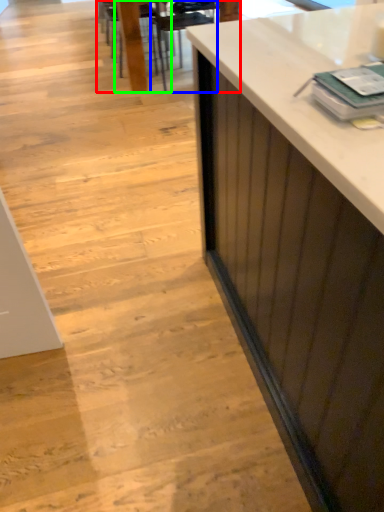
Question: Considering the real-world distances, which object is farthest from table (highlighted by a red box)? armchair (highlighted by a blue box) or chair (highlighted by a green box)?

Choices:
 (A) armchair
 (B) chair

Answer: (A)